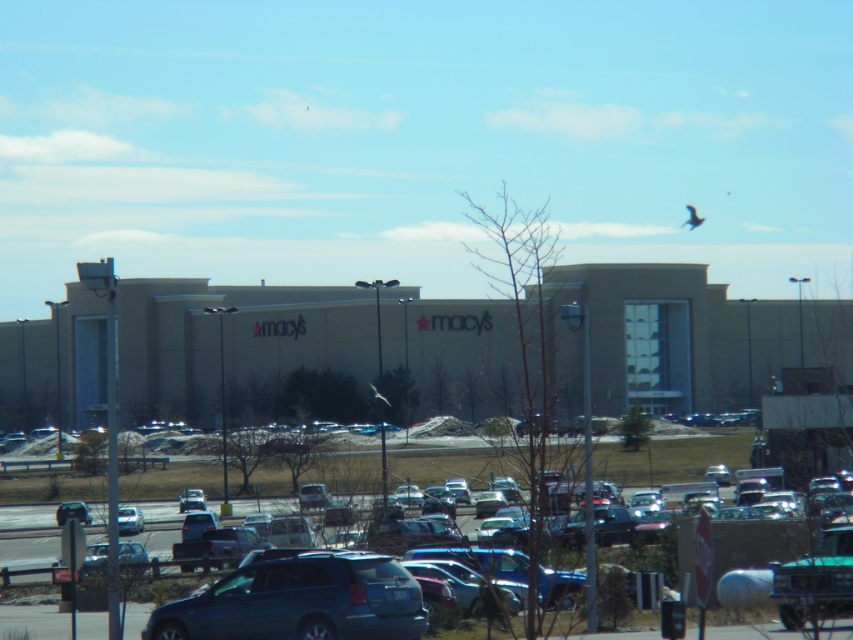
Consider the image. Between matte silver sedan at lower left and metallic silver car at lower left, which one appears on the left side from the viewer's perspective?

From the viewer's perspective, metallic silver car at lower left appears more on the left side.

Does matte silver sedan at lower left appear over metallic silver car at lower left?

Yes, matte silver sedan at lower left is above metallic silver car at lower left.

Is point (138, 516) positioned in front of point (64, 502)?

Yes, point (138, 516) is closer to viewer.

Find the location of a particular element. The width and height of the screenshot is (853, 640). matte silver sedan at lower left is located at coordinates (129, 520).

Can you confirm if metallic blue suv at center is shorter than metallic silver car at lower left?

Yes.

Does metallic blue suv at center appear on the right side of metallic silver car at lower left?

Yes, metallic blue suv at center is to the right of metallic silver car at lower left.

Find the location of a particular element. metallic blue suv at center is located at coordinates (300, 602).

This screenshot has width=853, height=640. I want to click on metallic blue suv at center, so click(300, 602).

Between point (817, 337) and point (119, 518), which one is positioned in front?

Positioned in front is point (119, 518).

Does point (773, 348) come behind point (120, 516)?

Yes, point (773, 348) is behind point (120, 516).

Find the location of a particular element. This screenshot has height=640, width=853. beige concrete mall at center is located at coordinates (683, 339).